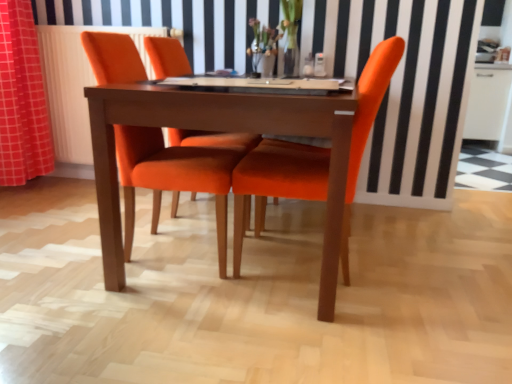
Question: Should I look upward or downward to see orange fabric chair at center, the 2th chair when ordered from right to left?

Choices:
 (A) down
 (B) up

Answer: (B)

Question: Does orange fabric chair at center, the first chair when ordered from right to left, appear on the right side of white radiator at left?

Choices:
 (A) no
 (B) yes

Answer: (B)

Question: Can you confirm if orange fabric chair at center, which appears as the second chair when viewed from the left, is shorter than white radiator at left?

Choices:
 (A) no
 (B) yes

Answer: (B)

Question: Is orange fabric chair at center, which appears as the second chair when viewed from the left, taller than white radiator at left?

Choices:
 (A) no
 (B) yes

Answer: (A)

Question: From the image's perspective, would you say orange fabric chair at center, the first chair when ordered from right to left, is positioned over white radiator at left?

Choices:
 (A) no
 (B) yes

Answer: (A)

Question: From a real-world perspective, is orange fabric chair at center, which appears as the second chair when viewed from the left, below white radiator at left?

Choices:
 (A) yes
 (B) no

Answer: (A)

Question: Is orange fabric chair at center, the first chair when ordered from right to left, smaller than white radiator at left?

Choices:
 (A) no
 (B) yes

Answer: (A)

Question: Is wooden table at center further to camera compared to orange fabric chair at center, the 2th chair when ordered from right to left?

Choices:
 (A) no
 (B) yes

Answer: (A)

Question: Can you confirm if wooden table at center is shorter than orange fabric chair at center, the 2th chair when ordered from right to left?

Choices:
 (A) no
 (B) yes

Answer: (B)

Question: Is wooden table at center positioned in front of orange fabric chair at center, the 2th chair when ordered from right to left?

Choices:
 (A) yes
 (B) no

Answer: (A)

Question: Could you tell me if wooden table at center is turned towards orange fabric chair at center, positioned as the 1th chair in left-to-right order?

Choices:
 (A) no
 (B) yes

Answer: (B)

Question: Considering the relative positions of wooden table at center and orange fabric chair at center, the 2th chair when ordered from right to left, in the image provided, is wooden table at center to the left of orange fabric chair at center, the 2th chair when ordered from right to left, from the viewer's perspective?

Choices:
 (A) yes
 (B) no

Answer: (B)

Question: Is wooden table at center positioned far away from orange fabric chair at center, positioned as the 1th chair in left-to-right order?

Choices:
 (A) yes
 (B) no

Answer: (B)

Question: From a real-world perspective, does orange fabric chair at center, the 2th chair when ordered from right to left, stand above orange fabric curtain at left?

Choices:
 (A) yes
 (B) no

Answer: (B)